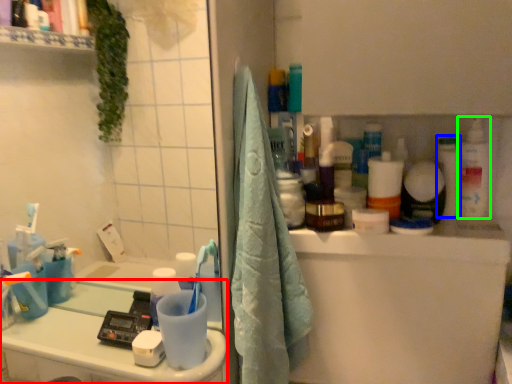
Question: Estimate the real-world distances between objects in this image. Which object is farther from counter top (highlighted by a red box), toiletry (highlighted by a blue box) or cleaning product (highlighted by a green box)?

Choices:
 (A) toiletry
 (B) cleaning product

Answer: (B)